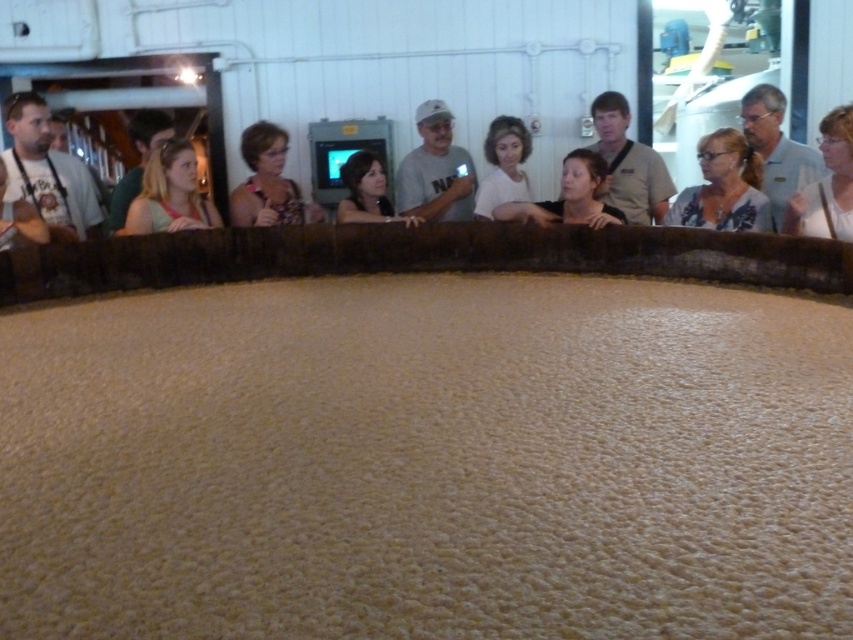
You are a tour guide explaining the fermentation process to visitors. You notice two items at the center of the scene. One is the black fabric at center and the other is the smooth beige shirt at center. Which of these two items is taller?

The black fabric at center is taller than the smooth beige shirt at center.